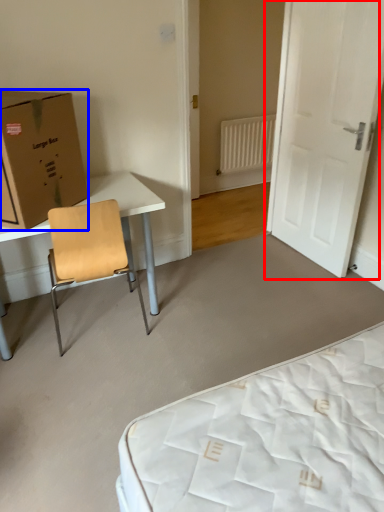
Question: Which of the following is the closest to the observer, door (highlighted by a red box) or box (highlighted by a blue box)?

Choices:
 (A) door
 (B) box

Answer: (B)